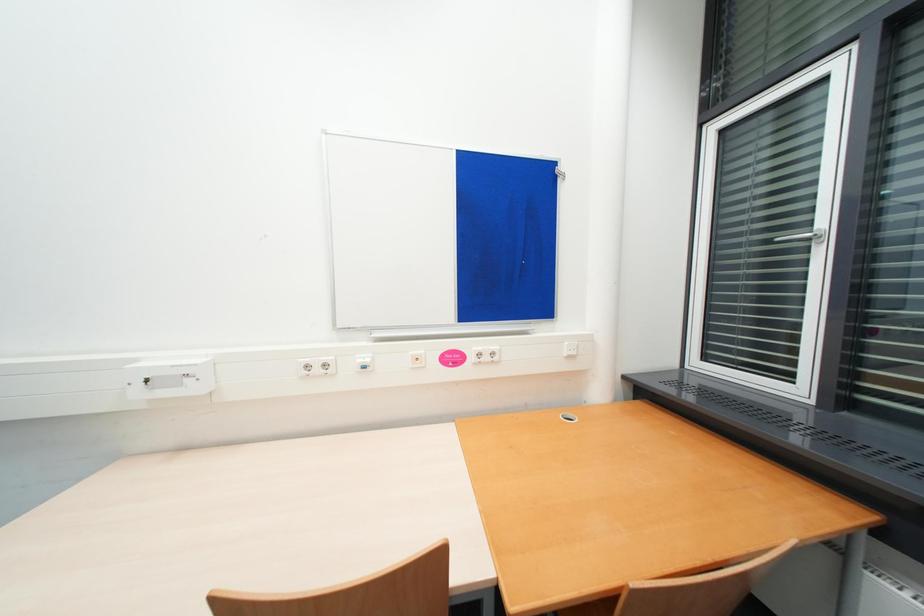
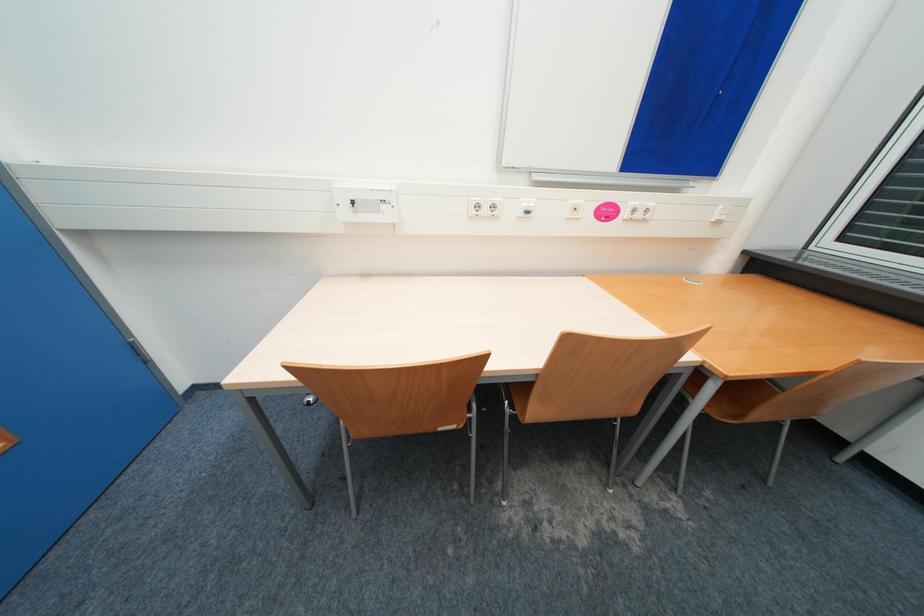
Question: The first image is from the beginning of the video and the second image is from the end. How did the camera likely rotate when shooting the video?

Choices:
 (A) Left
 (B) Right
 (C) Up
 (D) Down

Answer: (D)